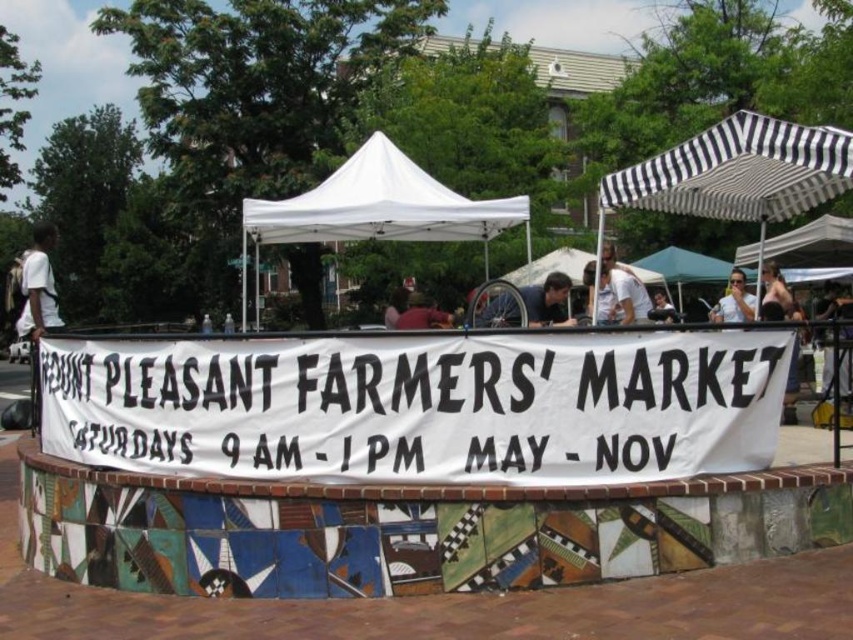
You are a vendor at the Mount Pleasant Farmers Market. You need to place a 10 meter long banner between the white fabric tent at center and the matte black sunglasses at upper right. Is this possible?

A: The distance between the white fabric tent at center and the matte black sunglasses at upper right is 8.03 meters. Since the banner is 10 meters long, it cannot be placed between them as it would be longer than the available space.

Based on the photo, you are a vendor at the Mount Pleasant Farmers Market and you want to place your sunglasses display under the white fabric tent at center. Can you fit the matte black sunglasses at upper right under the tent without moving the tent?

The white fabric tent at center is above the matte black sunglasses at upper right, so the sunglasses are already positioned under the tent. Therefore, you don not need to move the tent to place the display there.